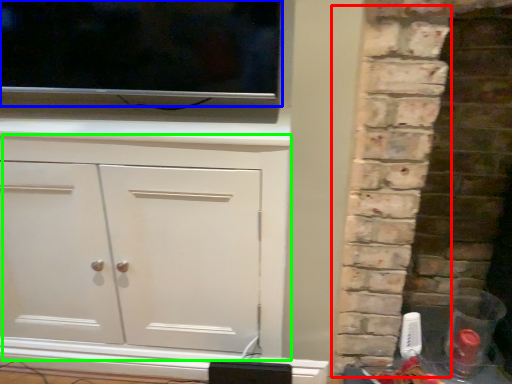
Question: Considering the real-world distances, which object is closest to brickwork (highlighted by a red box)? tv show (highlighted by a blue box) or cupboard (highlighted by a green box).

Choices:
 (A) tv show
 (B) cupboard

Answer: (B)